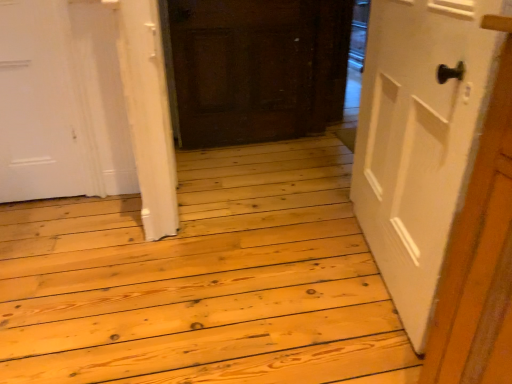
Where is `free spot below dark brown wood door at center, placed as the second door when sorted from front to back (from a real-world perspective)`? This screenshot has height=384, width=512. free spot below dark brown wood door at center, placed as the second door when sorted from front to back (from a real-world perspective) is located at coordinates (246, 144).